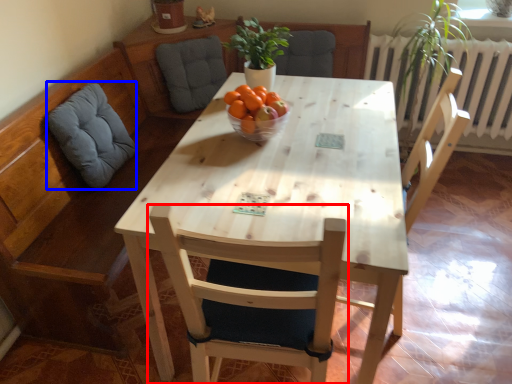
Question: Among these objects, which one is farthest to the camera, chair (highlighted by a red box) or swivel chair (highlighted by a blue box)?

Choices:
 (A) chair
 (B) swivel chair

Answer: (B)